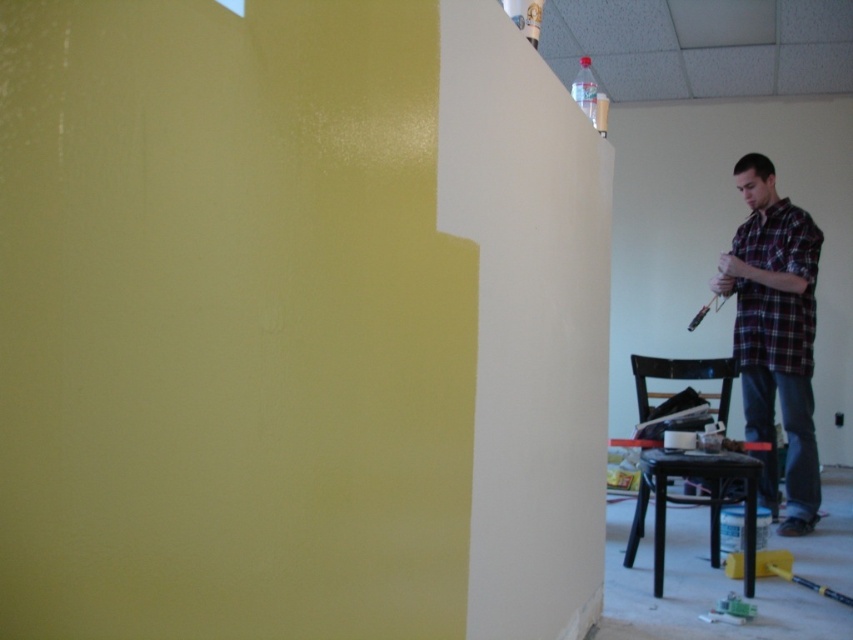
You are a contractor assessing the painting work in the room. You notice the plaid cotton shirt at right. Based on its position, is it closer to the freshly painted white wall or the yellow green wall?

The plaid cotton shirt at right is located at point (776, 289) which is closer to the freshly painted white wall on the right side of the frame.

You are a painter who needs to choose a shirt to wear that is less likely to get paint splatters. Based on the image, which shirt should you pick between the plaid shirt at right and the plaid cotton shirt at right?

The plaid cotton shirt at right is narrower than the plaid shirt at right, so it has a smaller surface area and is less likely to get paint splatters.